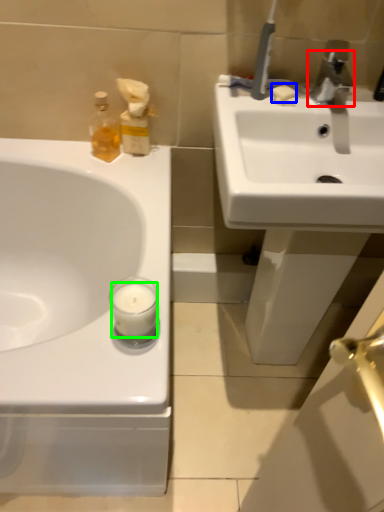
Question: Which object is positioned closest to tap (highlighted by a red box)? Select from soap (highlighted by a blue box) and candle (highlighted by a green box).

Choices:
 (A) soap
 (B) candle

Answer: (A)